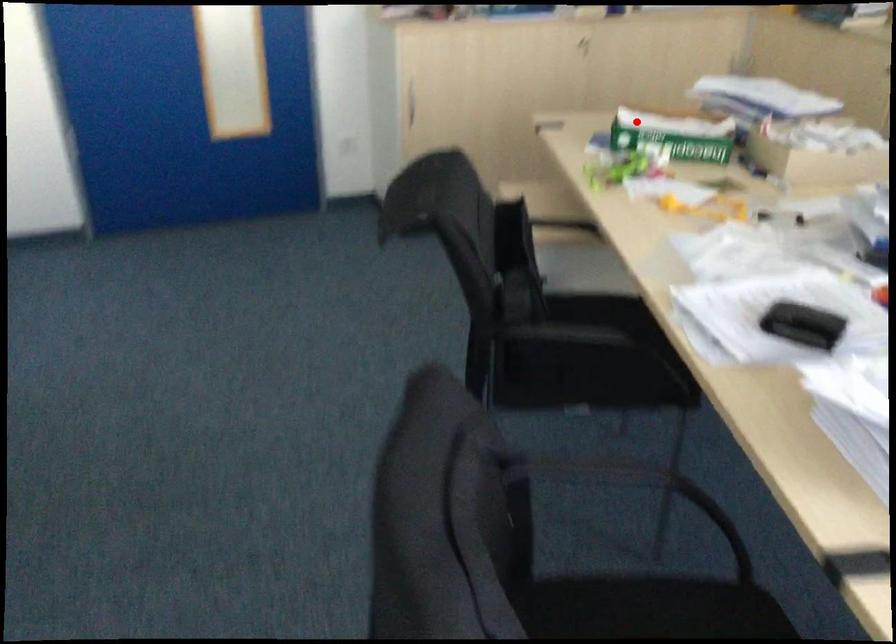
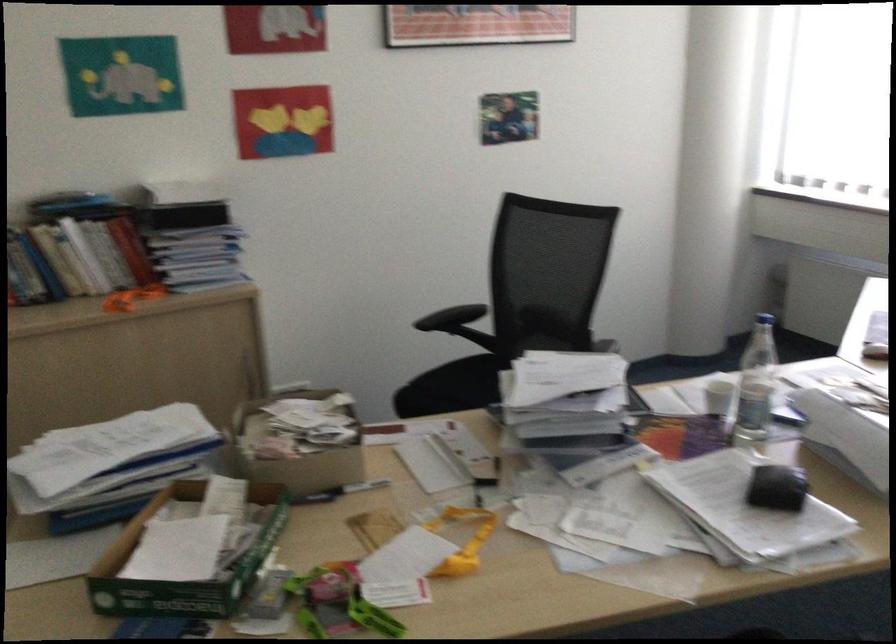
Question: I am providing you with two images of the same scene from different viewpoints. A red point is shown in image1. For the corresponding object point in image2, is it positioned nearer or farther from the camera?

Choices:
 (A) Nearer
 (B) Farther

Answer: (A)